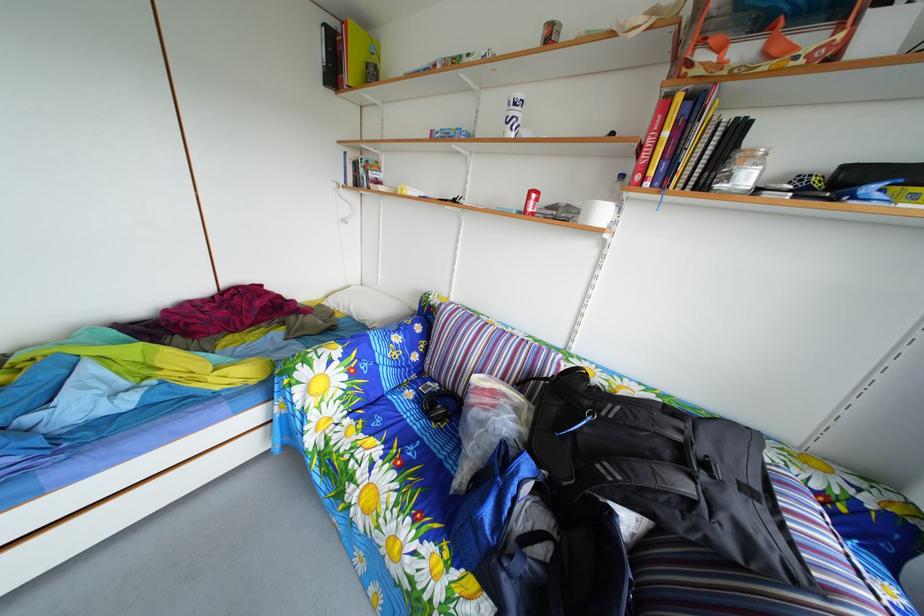
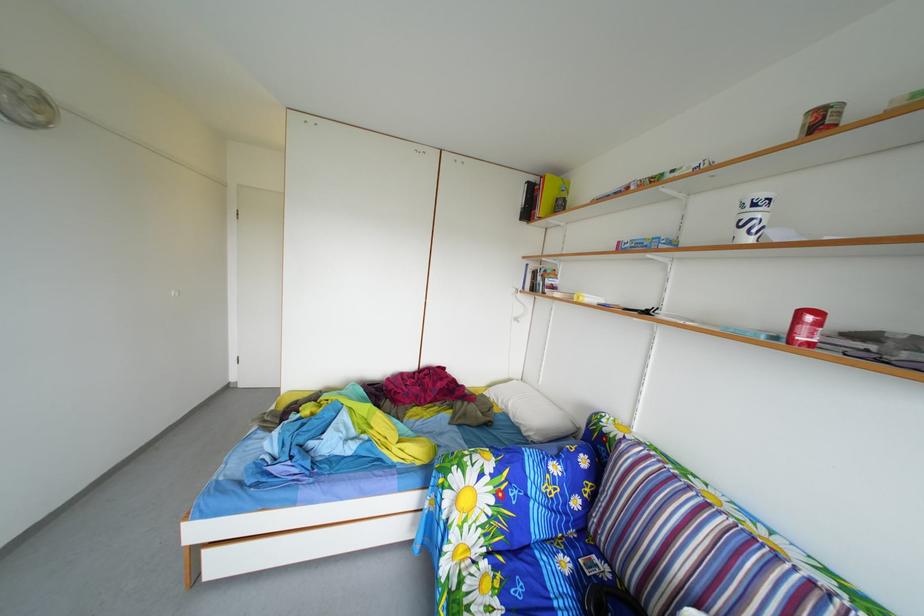
Find the pixel in the second image that matches point (541, 200) in the first image.

(811, 321)